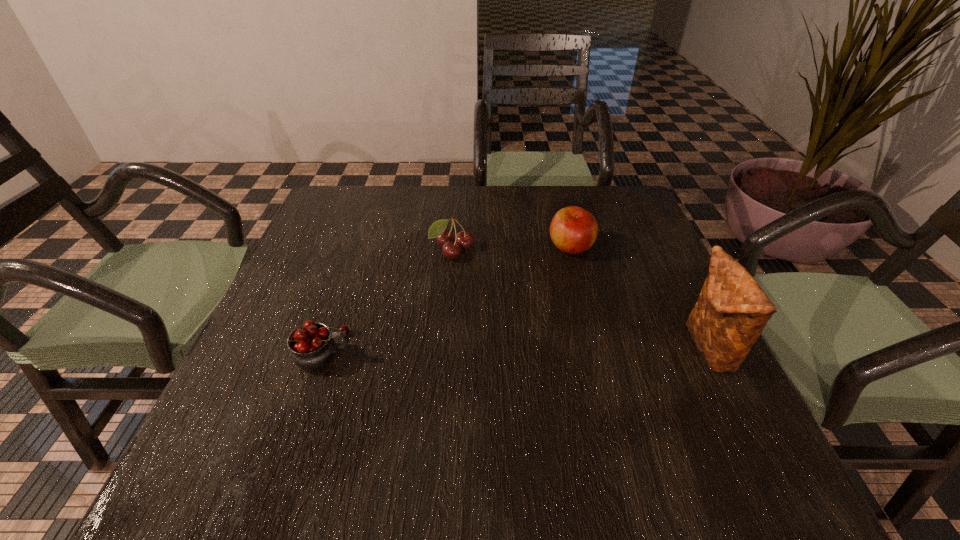
Where is `free spot on the desktop that is between the nearer cherry and the tallest object and is positioned on the leaves of the second object from left to right`? The width and height of the screenshot is (960, 540). free spot on the desktop that is between the nearer cherry and the tallest object and is positioned on the leaves of the second object from left to right is located at coordinates (516, 349).

Image resolution: width=960 pixels, height=540 pixels. I want to click on vacant spot on the desktop that is between the taller cherry and the rightmost object and is positioned on the stem of the third object from left to right, so click(x=570, y=349).